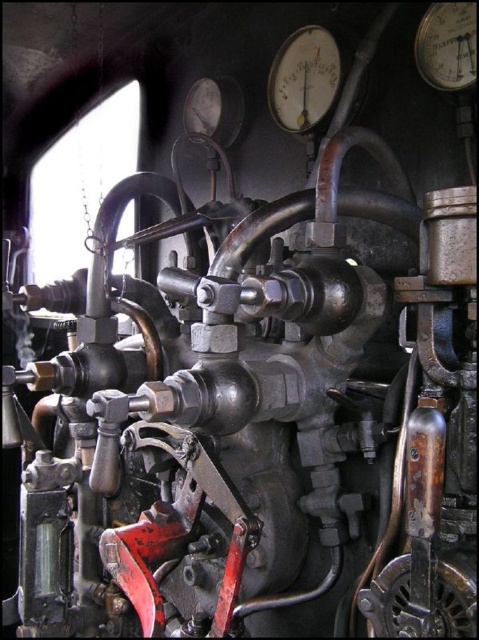
Does metallic gauge at upper center appear on the left side of metallic gauge at upper right?

Yes, metallic gauge at upper center is to the left of metallic gauge at upper right.

Find the location of a particular element. The height and width of the screenshot is (640, 479). metallic gauge at upper center is located at coordinates (304, 77).

The height and width of the screenshot is (640, 479). I want to click on metallic gauge at upper center, so click(x=304, y=77).